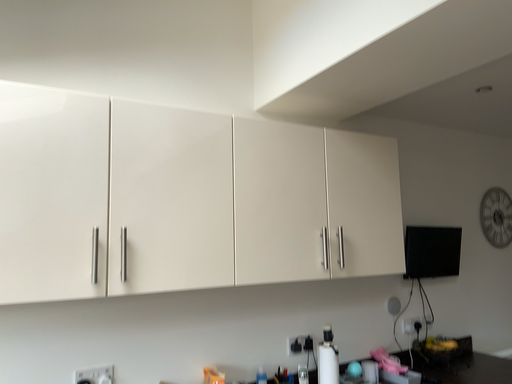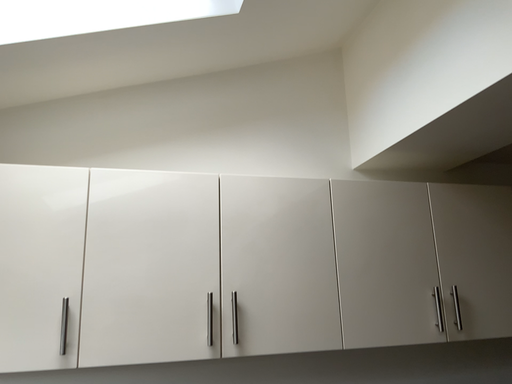
Question: Which way did the camera rotate in the video?

Choices:
 (A) rotated right
 (B) rotated left

Answer: (B)